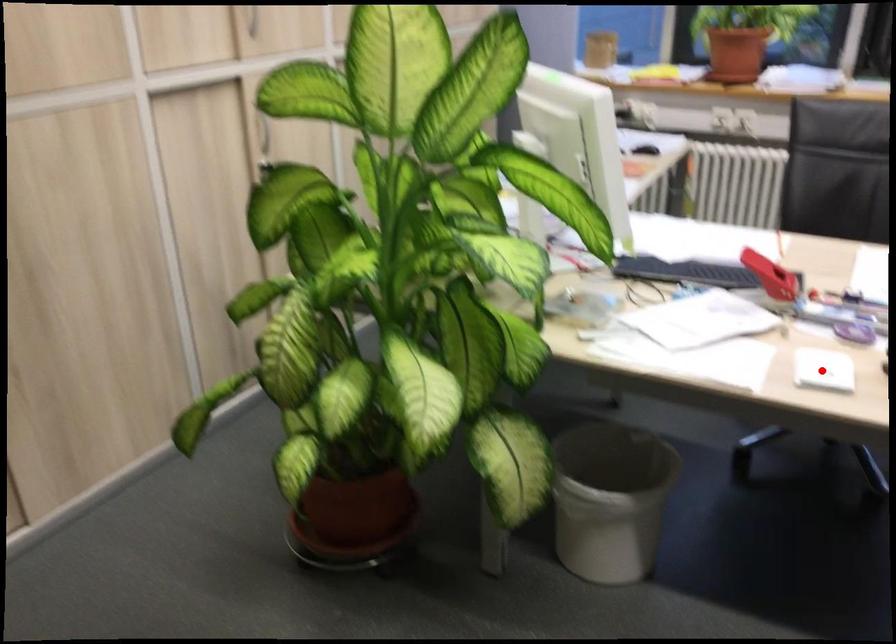
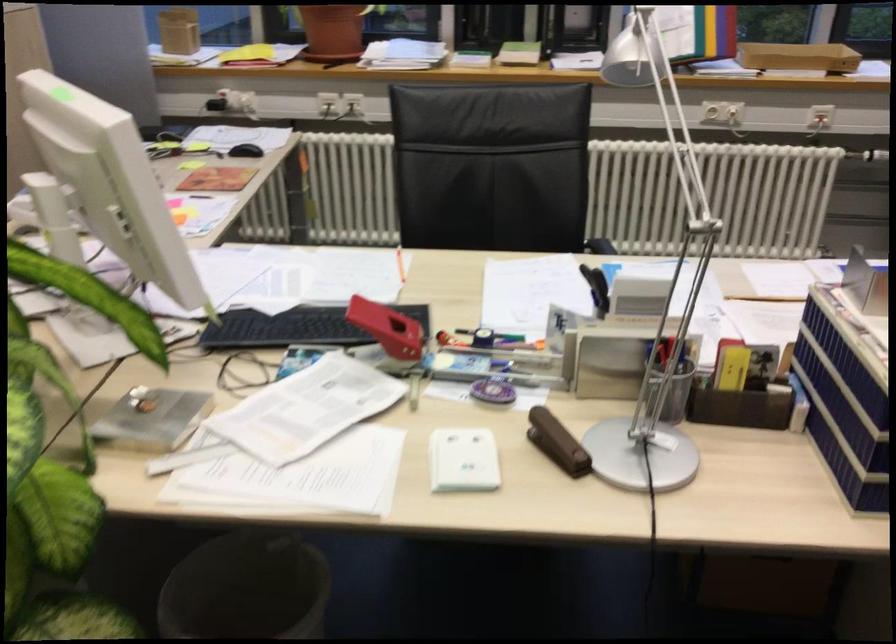
The point at the highlighted location is marked in the first image. Where is the corresponding point in the second image?

(462, 460)